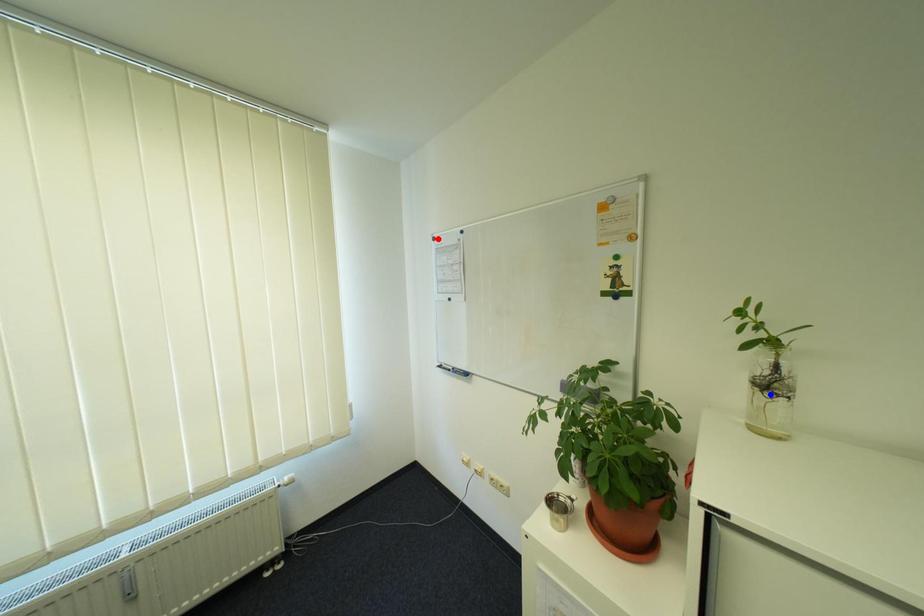
Question: Two points are marked on the image. Which point is closer to the camera?

Choices:
 (A) Blue point is closer.
 (B) Red point is closer.

Answer: (A)